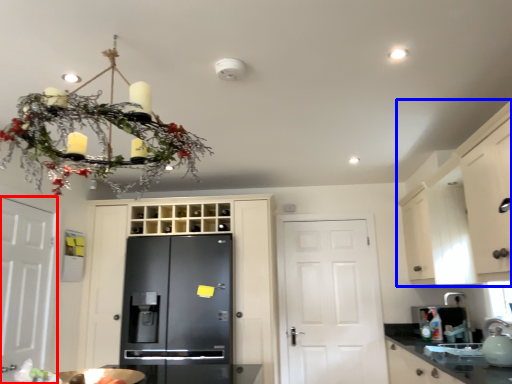
Question: Which point is further to the camera, door (highlighted by a red box) or cabinetry (highlighted by a blue box)?

Choices:
 (A) door
 (B) cabinetry

Answer: (A)